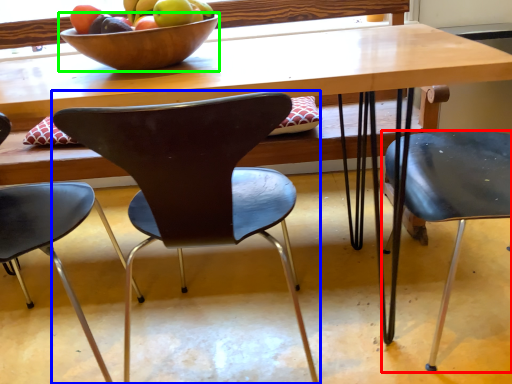
Question: Which object is positioned farthest from chair (highlighted by a red box)? Select from chair (highlighted by a blue box) and bowl (highlighted by a green box).

Choices:
 (A) chair
 (B) bowl

Answer: (B)